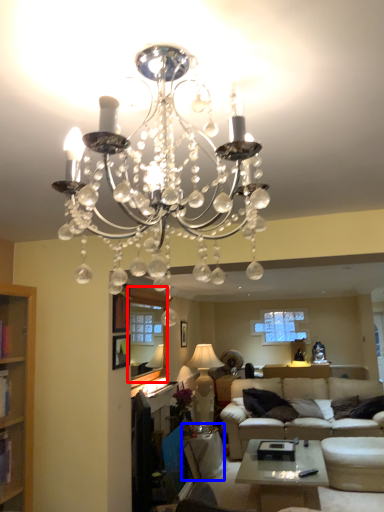
Question: Which object is further to the camera taking this photo, window screen (highlighted by a red box) or side table (highlighted by a blue box)?

Choices:
 (A) window screen
 (B) side table

Answer: (B)